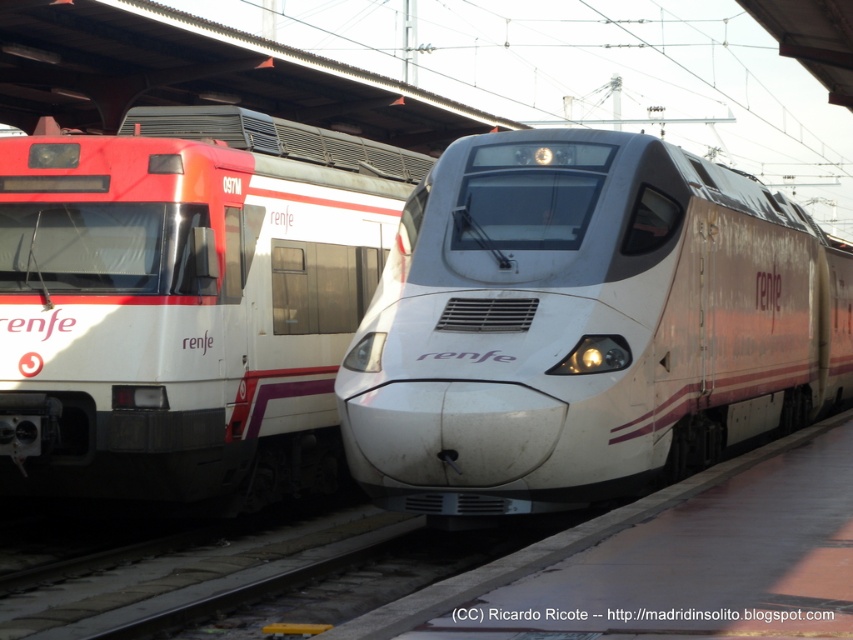
Question: Observing the image, what is the correct spatial positioning of white glossy train at center in reference to white glossy train at left?

Choices:
 (A) above
 (B) below

Answer: (B)

Question: Which point is farther to the camera?

Choices:
 (A) (195, 468)
 (B) (459, 362)

Answer: (A)

Question: Does white glossy train at center have a lesser width compared to white glossy train at left?

Choices:
 (A) no
 (B) yes

Answer: (A)

Question: Which of the following is the farthest from the observer?

Choices:
 (A) (556, 339)
 (B) (306, 256)

Answer: (B)

Question: Is white glossy train at center positioned before white glossy train at left?

Choices:
 (A) no
 (B) yes

Answer: (B)